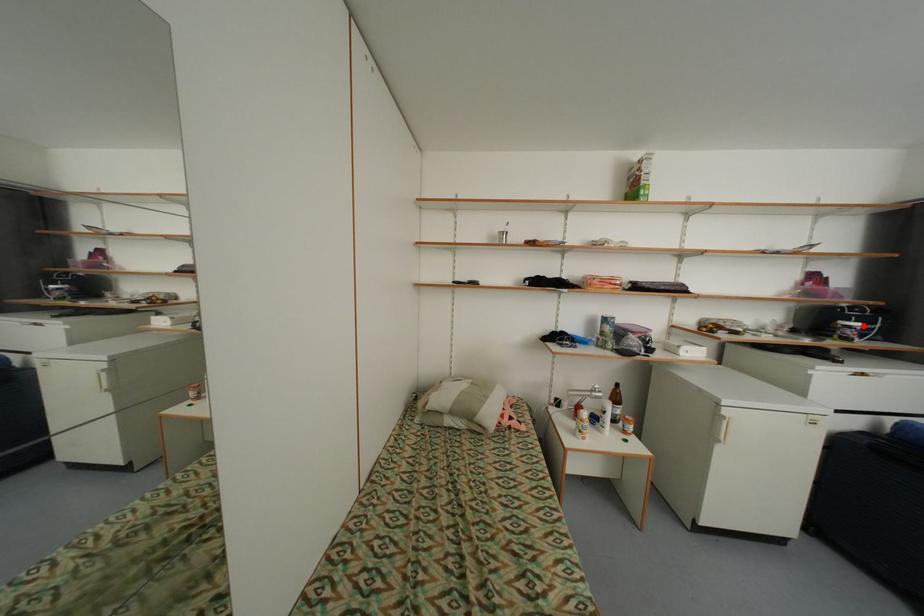
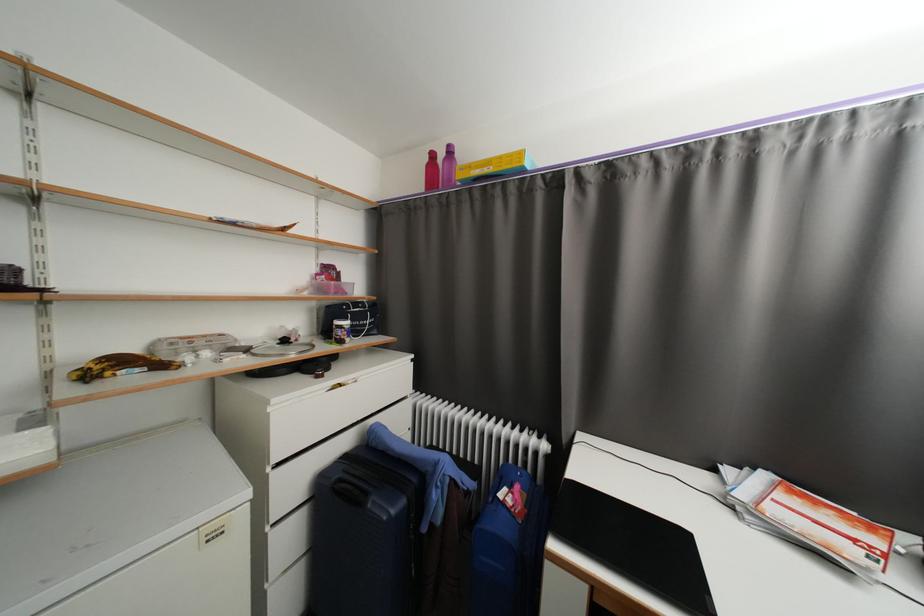
Find the pixel in the second image that matches the highlighted location in the first image.

(353, 323)